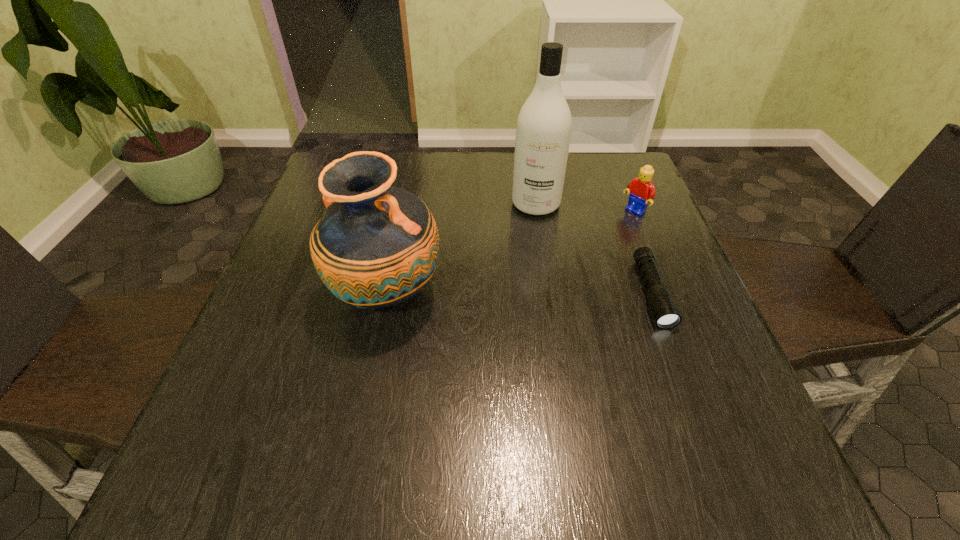
Where is `free space at the left edge of the desktop`? free space at the left edge of the desktop is located at coordinates (257, 354).

The width and height of the screenshot is (960, 540). Find the location of `vacant space at the right edge`. vacant space at the right edge is located at coordinates (616, 286).

Locate an element on the screen. This screenshot has height=540, width=960. vacant space that's between the tallest object and the flashlight is located at coordinates (593, 248).

Where is `vacant area that lies between the flashlight and the pottery`? vacant area that lies between the flashlight and the pottery is located at coordinates (519, 294).

Locate an element on the screen. The height and width of the screenshot is (540, 960). vacant region between the leftmost object and the shortest object is located at coordinates (519, 294).

The image size is (960, 540). In order to click on unoccupied area between the leftmost object and the shortest object in this screenshot , I will do `click(519, 294)`.

In order to click on vacant area that lies between the flashlight and the leftmost object in this screenshot , I will do `click(519, 294)`.

Locate an element on the screen. free space between the pottery and the shampoo is located at coordinates (461, 249).

Where is `vacant area between the shampoo and the third tallest object`? vacant area between the shampoo and the third tallest object is located at coordinates (585, 208).

This screenshot has width=960, height=540. What are the coordinates of `empty space that is in between the third tallest object and the shampoo` in the screenshot? It's located at pyautogui.click(x=585, y=208).